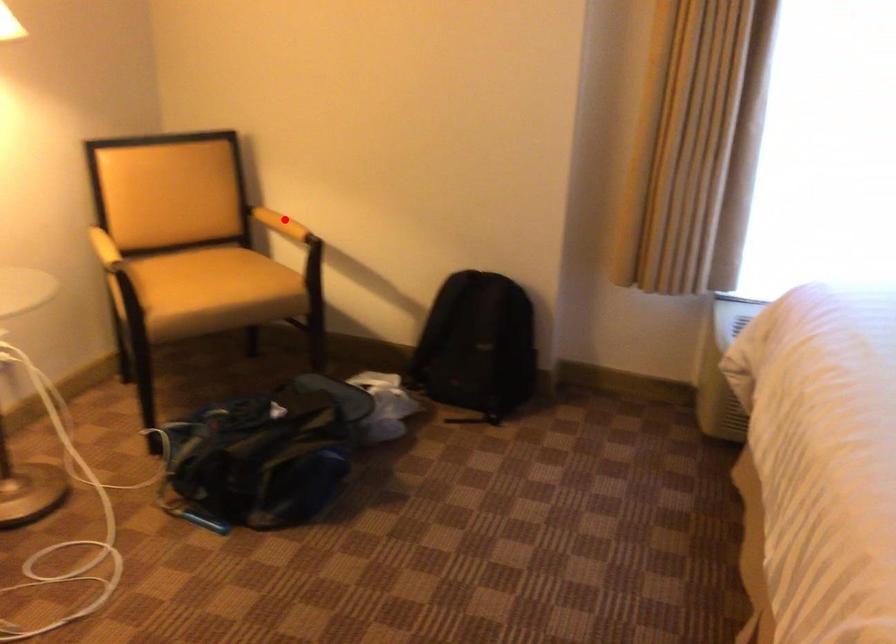
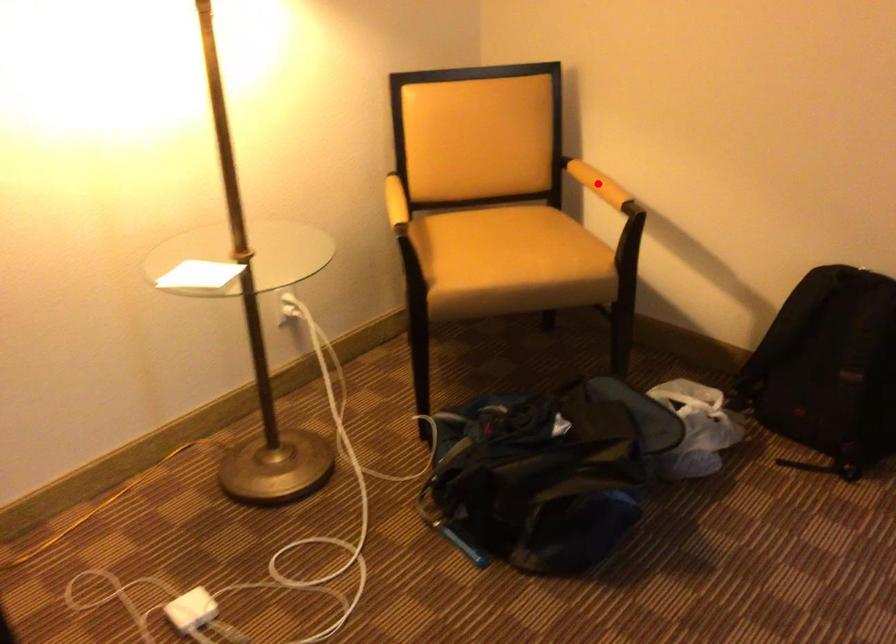
I am providing you with two images of the same scene from different viewpoints. A red point is marked on the first image and another point is marked on the second image. Do the highlighted points in image1 and image2 indicate the same real-world spot?

Yes